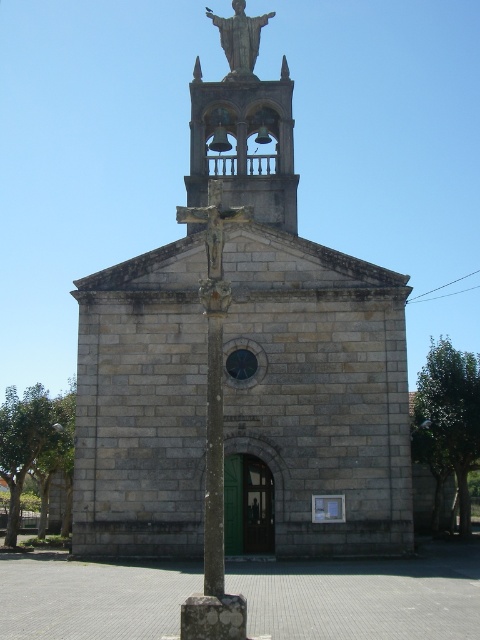
Based on the photo, who is taller, gray stone church at center or gold metallic statue at upper center?

gray stone church at center is taller.

Does gray stone church at center appear on the left side of gold metallic statue at upper center?

Correct, you'll find gray stone church at center to the left of gold metallic statue at upper center.

I want to click on gray stone church at center, so click(x=243, y=369).

What do you see at coordinates (243, 369) in the screenshot?
I see `gray stone church at center` at bounding box center [243, 369].

Is point (189, 333) positioned behind point (232, 6)?

No, (189, 333) is closer to viewer.

You are a GUI agent. You are given a task and a screenshot of the screen. Output one action in this format:
    pyautogui.click(x=<x>, y=<y>)
    Task: Click on the gray stone church at center
    The image size is (480, 640).
    Given the screenshot: What is the action you would take?
    pyautogui.click(x=243, y=369)

Identify the location of bronze bell tower at upper center. (243, 128).

Locate an element on the screen. bronze bell tower at upper center is located at coordinates (243, 128).